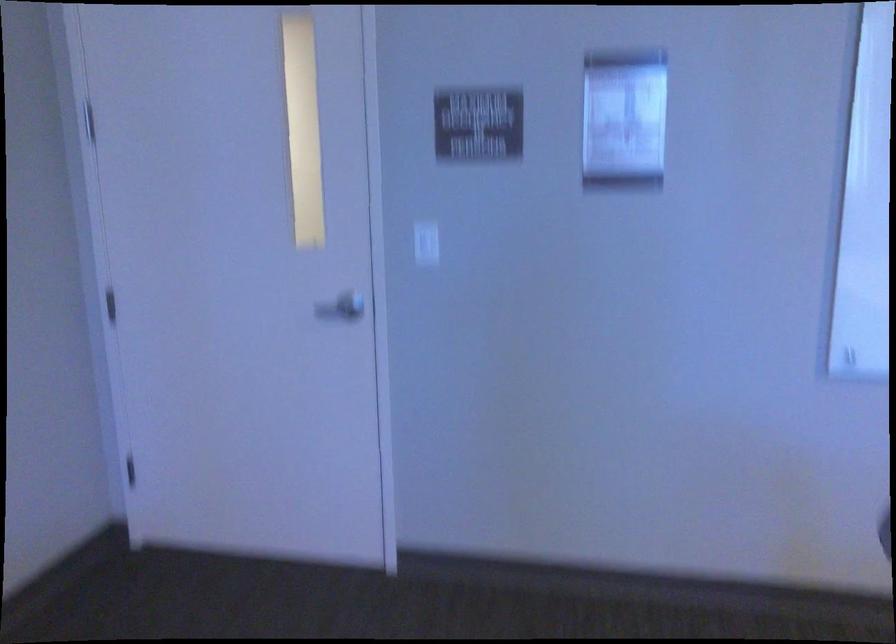
The width and height of the screenshot is (896, 644). What do you see at coordinates (343, 306) in the screenshot?
I see `the metal door handle` at bounding box center [343, 306].